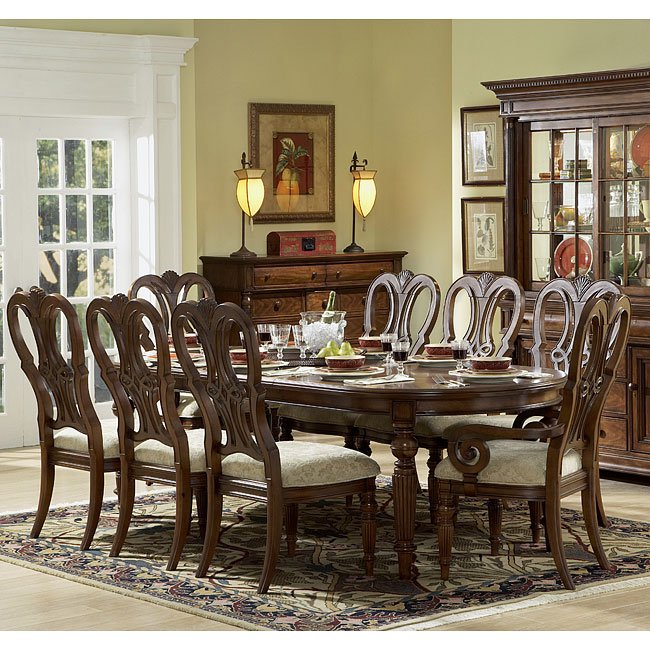
The width and height of the screenshot is (650, 650). Find the location of `bowls`. bowls is located at coordinates (348, 358), (254, 352), (182, 341), (367, 341), (437, 348), (488, 367).